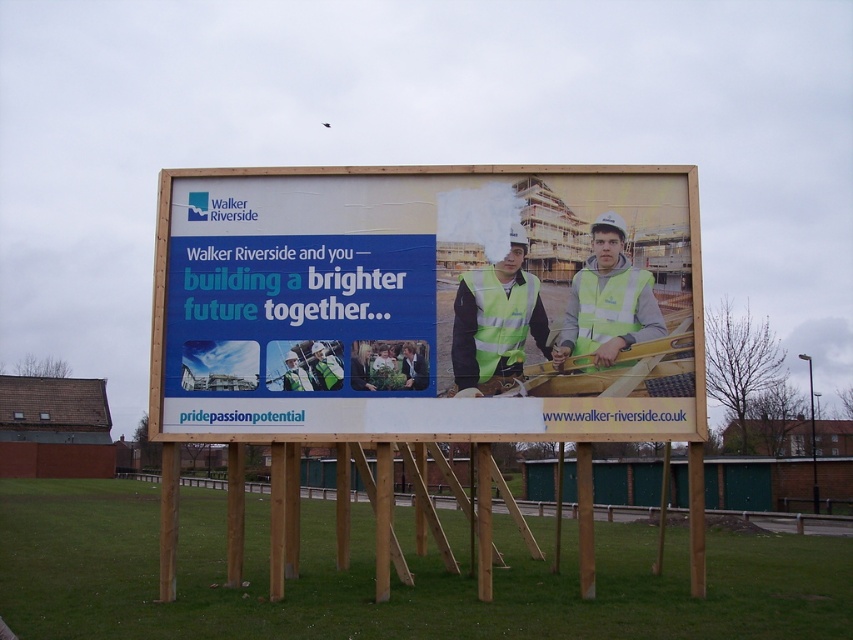
Question: Which point is farther from the camera taking this photo?

Choices:
 (A) (531, 308)
 (B) (363, 364)
 (C) (618, 314)

Answer: (A)

Question: Among these objects, which one is nearest to the camera?

Choices:
 (A) high visibility vest at center
 (B) matte yellow billboard at center
 (C) high visibility yellow-green vest at center

Answer: (A)

Question: Among these objects, which one is farthest from the camera?

Choices:
 (A) matte yellow billboard at center
 (B) high visibility vest at center
 (C) high visibility yellow-green vest at center

Answer: (A)

Question: Can you confirm if matte yellow billboard at center is bigger than high visibility yellow-green vest at center?

Choices:
 (A) yes
 (B) no

Answer: (B)

Question: Can you confirm if matte yellow billboard at center is positioned to the left of high visibility vest at center?

Choices:
 (A) no
 (B) yes

Answer: (B)

Question: Can you confirm if matte yellow billboard at center is positioned to the left of high visibility vest at center?

Choices:
 (A) no
 (B) yes

Answer: (B)